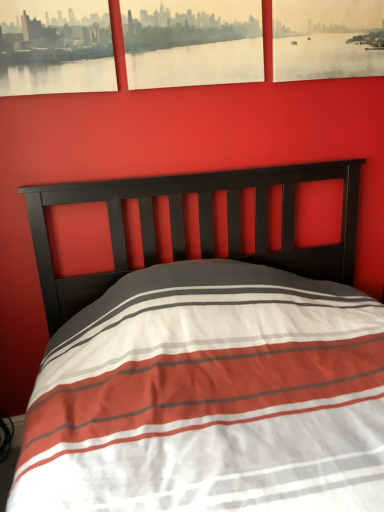
Question: Is matte black picture frame at upper left, the third picture frame in the right-to-left sequence, situated inside matte paper picture frame at upper right, which is the 3th picture frame in left-to-right order, or outside?

Choices:
 (A) inside
 (B) outside

Answer: (B)

Question: Considering the positions of point (102, 10) and point (342, 59), is point (102, 10) closer or farther from the camera than point (342, 59)?

Choices:
 (A) farther
 (B) closer

Answer: (B)

Question: Considering the real-world distances, which object is closest to the matte black picture frame at upper left, the third picture frame in the right-to-left sequence?

Choices:
 (A) matte paper picture frame at upper center, acting as the second picture frame starting from the left
 (B) matte paper picture frame at upper right, which ranks as the first picture frame in right-to-left order

Answer: (A)

Question: Which object is the farthest from the matte paper picture frame at upper right, which is the 3th picture frame in left-to-right order?

Choices:
 (A) matte black picture frame at upper left, the third picture frame in the right-to-left sequence
 (B) matte paper picture frame at upper center, acting as the second picture frame starting from the right

Answer: (A)